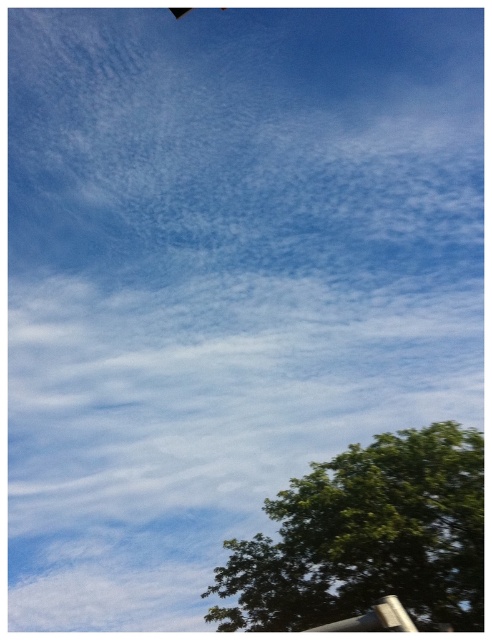
Is green leafy tree at lower right taller than brushed metal pole at lower right?

No.

Identify the location of green leafy tree at lower right. (368, 538).